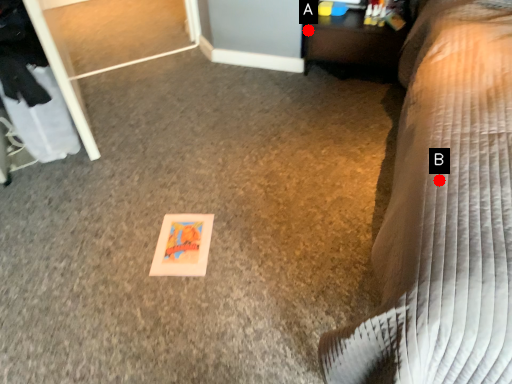
Question: Two points are circled on the image, labeled by A and B beside each circle. Which point is farther from the camera taking this photo?

Choices:
 (A) A is further
 (B) B is further

Answer: (A)